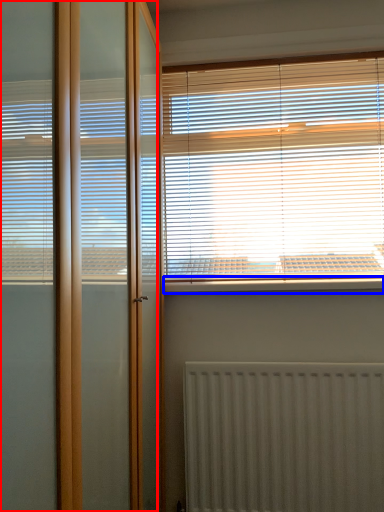
Question: Which point is closer to the camera, screen door (highlighted by a red box) or window sill (highlighted by a blue box)?

Choices:
 (A) screen door
 (B) window sill

Answer: (A)